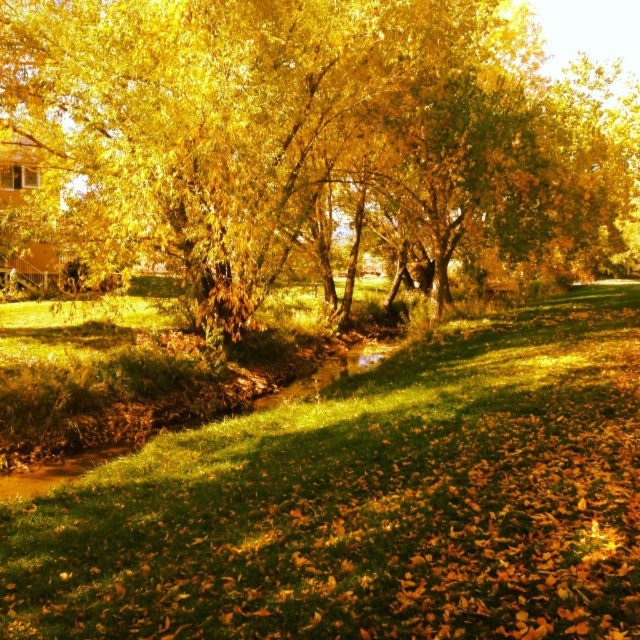
Does golden leafy tree at center have a lesser width compared to green grass at center?

Incorrect, golden leafy tree at center's width is not less than green grass at center's.

Is point (234, 138) farther from camera compared to point (268, 588)?

Yes, point (234, 138) is behind point (268, 588).

Which is in front, point (518, 177) or point (330, 609)?

Positioned in front is point (330, 609).

The width and height of the screenshot is (640, 640). In order to click on golden leafy tree at center in this screenshot , I will do `click(310, 141)`.